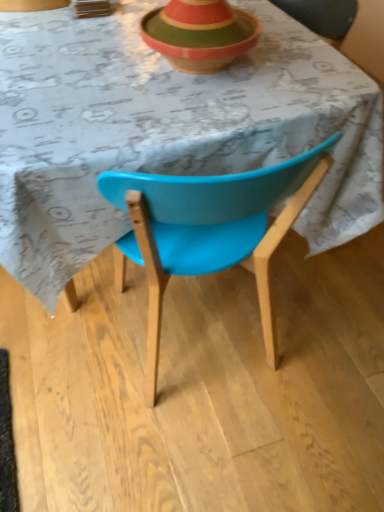
The width and height of the screenshot is (384, 512). In order to click on spots to the right of wooden striped bowl at upper center in this screenshot , I will do `click(298, 62)`.